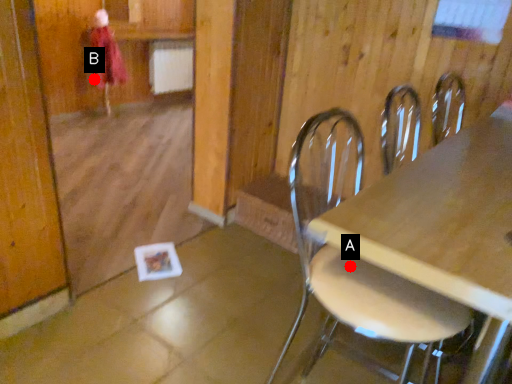
Question: Two points are circled on the image, labeled by A and B beside each circle. Among these points, which one is farthest from the camera?

Choices:
 (A) A is further
 (B) B is further

Answer: (B)